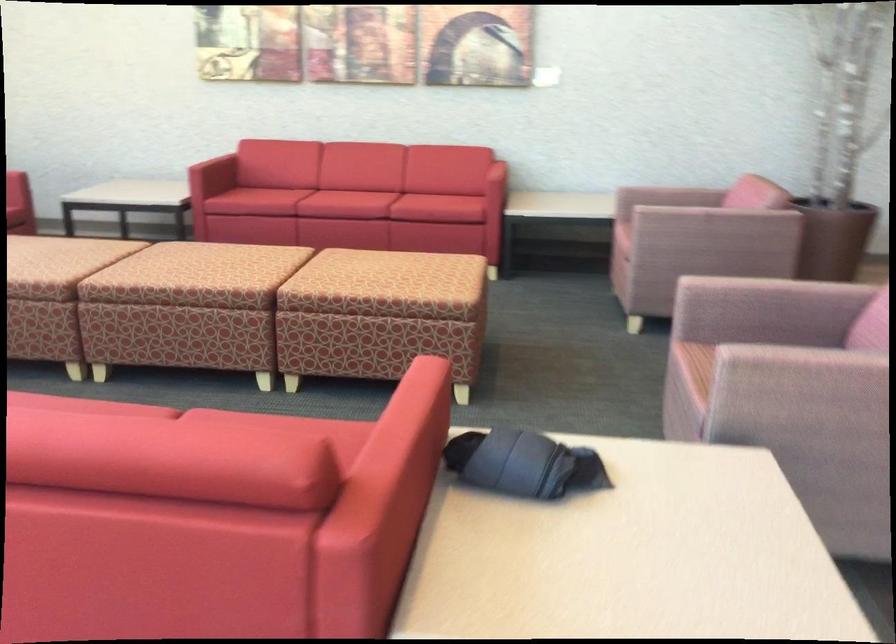
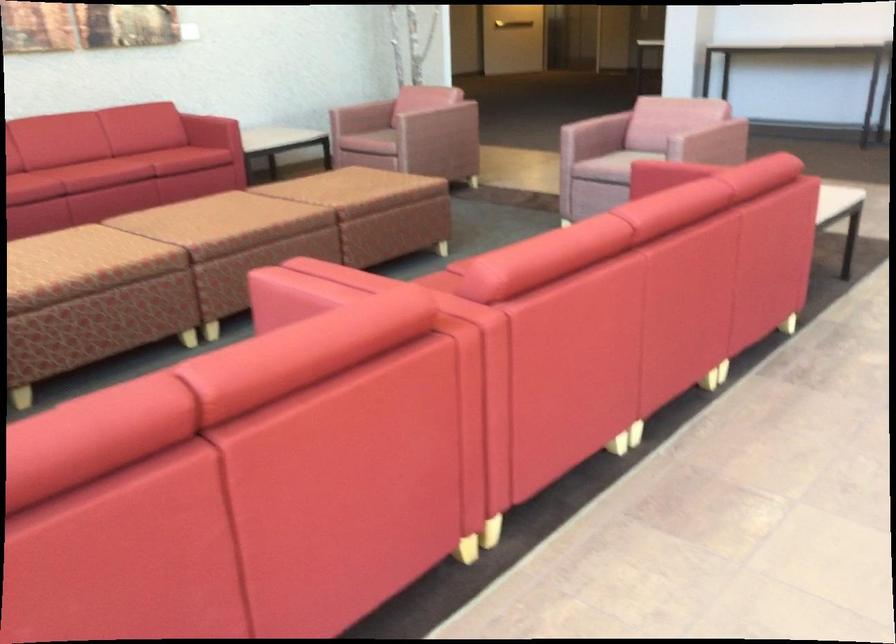
The point at (140, 277) is marked in the first image. Where is the corresponding point in the second image?

(254, 234)